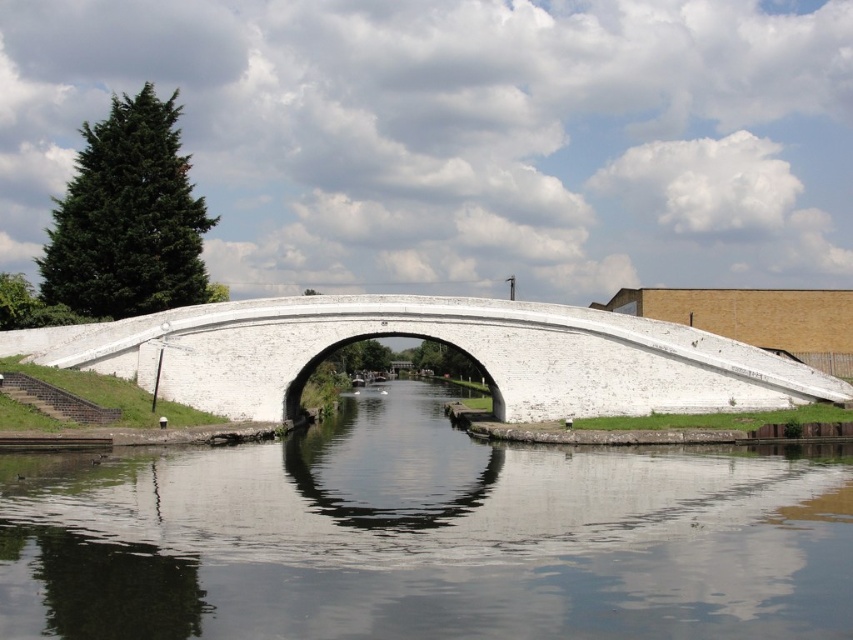
Which is more to the right, smooth concrete water at center or white concrete bridge at center?

smooth concrete water at center

Which is above, smooth concrete water at center or white concrete bridge at center?

Positioned higher is white concrete bridge at center.

Does point (84, 540) lie in front of point (55, 339)?

Yes, point (84, 540) is in front of point (55, 339).

Locate an element on the screen. smooth concrete water at center is located at coordinates (425, 536).